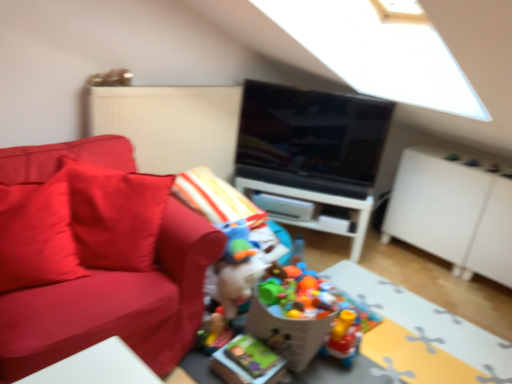
Measure the distance between black glossy tv at center and camera.

2.67 meters.

What is the approximate height of matte red pillow at left?

matte red pillow at left is 21.01 inches in height.

The width and height of the screenshot is (512, 384). What do you see at coordinates (322, 216) in the screenshot?
I see `white plastic table at center, the second table in the front-to-back sequence` at bounding box center [322, 216].

Image resolution: width=512 pixels, height=384 pixels. Describe the element at coordinates (312, 316) in the screenshot. I see `plastic colorful toys at center, arranged as the 1th toy when viewed from the back` at that location.

In the scene shown: Measure the distance between plastic colorful toys at center, which is counted as the 3th toy, starting from the front, and camera.

A distance of 5.95 feet exists between plastic colorful toys at center, which is counted as the 3th toy, starting from the front, and camera.

What do you see at coordinates (242, 276) in the screenshot?
I see `multicolored plastic toys at center, which is the first toy in front-to-back order` at bounding box center [242, 276].

This screenshot has width=512, height=384. Describe the element at coordinates (453, 214) in the screenshot. I see `white matte dresser at right` at that location.

The image size is (512, 384). What are the coordinates of `cardboard box at center, which is the first table from bottom to top` in the screenshot? It's located at (423, 334).

Do you think plastic colorful toys at center, arranged as the 1th toy when viewed from the back, is within matte red pillow at left, or outside of it?

plastic colorful toys at center, arranged as the 1th toy when viewed from the back, is not inside matte red pillow at left, it's outside.

Considering the positions of objects plastic colorful toys at center, arranged as the 1th toy when viewed from the back, and matte red pillow at left in the image provided, who is more to the right, plastic colorful toys at center, arranged as the 1th toy when viewed from the back, or matte red pillow at left?

Positioned to the right is plastic colorful toys at center, arranged as the 1th toy when viewed from the back.

Considering the positions of point (269, 277) and point (25, 184), is point (269, 277) closer or farther from the camera than point (25, 184)?

Point (269, 277) is farther from the camera than point (25, 184).

From a real-world perspective, is plastic colorful toys at center, arranged as the 1th toy when viewed from the back, positioned above or below matte red pillow at left?

In terms of real-world spatial position, plastic colorful toys at center, arranged as the 1th toy when viewed from the back, is below matte red pillow at left.

Is point (266, 156) behind point (339, 355)?

Yes, it is.

From a real-world perspective, which object rests below the other?

translucent plastic toy at center, marked as the second toy in a back-to-front arrangement.

Considering their positions, is black glossy tv at center located in front of or behind translucent plastic toy at center, marked as the second toy in a back-to-front arrangement?

In the image, black glossy tv at center appears behind translucent plastic toy at center, marked as the second toy in a back-to-front arrangement.

Does black glossy tv at center have a greater width compared to translucent plastic toy at center, arranged as the second toy when viewed from the front?

No.

Consider the image. Are matte red pillow at left and cardboard box at center, arranged as the 2th table when viewed from the top, located far from each other?

matte red pillow at left is far away from cardboard box at center, arranged as the 2th table when viewed from the top.

Could you tell me if matte red pillow at left is turned towards cardboard box at center, arranged as the 2th table when viewed from the top?

No, matte red pillow at left is not aimed at cardboard box at center, arranged as the 2th table when viewed from the top.

Looking at the image, does matte red pillow at left seem bigger or smaller compared to cardboard box at center, which is the first table from bottom to top?

matte red pillow at left is bigger than cardboard box at center, which is the first table from bottom to top.

Between matte red pillow at left and cardboard box at center, marked as the first table in a front-to-back arrangement, which one is positioned in front?

Answer: cardboard box at center, marked as the first table in a front-to-back arrangement, is more forward.

Which is more to the right, plastic colorful toys at center, arranged as the 1th toy when viewed from the back, or white plastic table at center, positioned as the 1th table in back-to-front order?

From the viewer's perspective, plastic colorful toys at center, arranged as the 1th toy when viewed from the back, appears more on the right side.

Is white plastic table at center, which is counted as the 2th table, starting from the bottom, at the back of plastic colorful toys at center, which is counted as the 3th toy, starting from the front?

Yes, white plastic table at center, which is counted as the 2th table, starting from the bottom, is at the back of plastic colorful toys at center, which is counted as the 3th toy, starting from the front.

Does plastic colorful toys at center, arranged as the 1th toy when viewed from the back, have a smaller size compared to white plastic table at center, the second table in the front-to-back sequence?

Yes, plastic colorful toys at center, arranged as the 1th toy when viewed from the back, is smaller than white plastic table at center, the second table in the front-to-back sequence.

Is matte red pillow at left facing away from white plastic table at center, positioned as the 1th table in back-to-front order?

No, matte red pillow at left is not facing the opposite direction of white plastic table at center, positioned as the 1th table in back-to-front order.

Is point (52, 233) less distant than point (361, 205)?

Yes, it is in front of point (361, 205).

Considering the sizes of objects matte red pillow at left and white plastic table at center, which is counted as the 2th table, starting from the bottom, in the image provided, who is smaller, matte red pillow at left or white plastic table at center, which is counted as the 2th table, starting from the bottom,?

→ matte red pillow at left is smaller.

From the image's perspective, is matte red pillow at left on top of white plastic table at center, the 1th table when ordered from top to bottom?

Yes.

Considering the sizes of objects white plastic table at center, positioned as the 1th table in back-to-front order, and multicolored plastic toys at center, which is the first toy in front-to-back order, in the image provided, who is thinner, white plastic table at center, positioned as the 1th table in back-to-front order, or multicolored plastic toys at center, which is the first toy in front-to-back order,?

white plastic table at center, positioned as the 1th table in back-to-front order, is thinner.

Is point (351, 206) positioned before point (265, 340)?

That is False.

Is white plastic table at center, which is counted as the 2th table, starting from the bottom, at the left side of multicolored plastic toys at center, which is the third toy from back to front?

Incorrect, white plastic table at center, which is counted as the 2th table, starting from the bottom, is not on the left side of multicolored plastic toys at center, which is the third toy from back to front.

Is white plastic table at center, positioned as the 1th table in back-to-front order, in contact with multicolored plastic toys at center, which is the first toy in front-to-back order?

No, white plastic table at center, positioned as the 1th table in back-to-front order, is not in contact with multicolored plastic toys at center, which is the first toy in front-to-back order.

Can white matte dresser at right be found inside multicolored plastic toys at center, which is the first toy in front-to-back order?

No, white matte dresser at right is not a part of multicolored plastic toys at center, which is the first toy in front-to-back order.

Does point (244, 286) come behind point (434, 217)?

No, it is in front of (434, 217).

Considering the relative positions of multicolored plastic toys at center, which is the third toy from back to front, and white matte dresser at right in the image provided, is multicolored plastic toys at center, which is the third toy from back to front, to the left of white matte dresser at right from the viewer's perspective?

Indeed, multicolored plastic toys at center, which is the third toy from back to front, is positioned on the left side of white matte dresser at right.

Is multicolored plastic toys at center, which is the third toy from back to front, facing towards white matte dresser at right?

No, multicolored plastic toys at center, which is the third toy from back to front, is not facing towards white matte dresser at right.

This screenshot has width=512, height=384. Identify the location of the 3rd toy directly beneath the matte red pillow at left (from a real-world perspective). (312, 316).

The width and height of the screenshot is (512, 384). I want to click on television above the translucent plastic toy at center, marked as the second toy in a back-to-front arrangement (from the image's perspective), so click(x=311, y=139).

Looking at the image, which one is located closer to white plastic table at center, positioned as the 1th table in back-to-front order, multicolored plastic toys at center, which is the third toy from back to front, or white matte dresser at right?

white matte dresser at right.

When comparing their distances from multicolored plastic toys at center, which is the first toy in front-to-back order, does matte red couch at left or translucent plastic toy at center, arranged as the second toy when viewed from the front, seem closer?

translucent plastic toy at center, arranged as the second toy when viewed from the front, is closer to multicolored plastic toys at center, which is the first toy in front-to-back order.

When comparing their distances from cardboard box at center, marked as the first table in a front-to-back arrangement, does black glossy tv at center or plastic colorful toys at center, which is counted as the 3th toy, starting from the front, seem closer?

Among the two, plastic colorful toys at center, which is counted as the 3th toy, starting from the front, is located nearer to cardboard box at center, marked as the first table in a front-to-back arrangement.

When comparing their distances from white plastic table at center, the second table in the front-to-back sequence, does black glossy tv at center or multicolored plastic toys at center, which is the first toy in front-to-back order, seem further?

multicolored plastic toys at center, which is the first toy in front-to-back order, is further to white plastic table at center, the second table in the front-to-back sequence.

Estimate the real-world distances between objects in this image. Which object is closer to cardboard box at center, which is the first table from bottom to top, white matte dresser at right or plastic colorful toys at center, arranged as the 1th toy when viewed from the back?

Based on the image, plastic colorful toys at center, arranged as the 1th toy when viewed from the back, appears to be nearer to cardboard box at center, which is the first table from bottom to top.

Based on their spatial positions, is matte red pillow at left or plastic colorful toys at center, arranged as the 1th toy when viewed from the back, closer to cardboard box at center, arranged as the 2th table when viewed from the top?

plastic colorful toys at center, arranged as the 1th toy when viewed from the back, is closer to cardboard box at center, arranged as the 2th table when viewed from the top.

When comparing their distances from translucent plastic toy at center, arranged as the second toy when viewed from the front, does matte red pillow at left or white plastic table at center, which is counted as the 2th table, starting from the bottom, seem closer?

white plastic table at center, which is counted as the 2th table, starting from the bottom, is positioned closer to the anchor translucent plastic toy at center, arranged as the second toy when viewed from the front.

Based on their spatial positions, is multicolored plastic toys at center, which is the first toy in front-to-back order, or cardboard box at center, which is the first table from bottom to top, closer to translucent plastic toy at center, marked as the second toy in a back-to-front arrangement?

Based on the image, cardboard box at center, which is the first table from bottom to top, appears to be nearer to translucent plastic toy at center, marked as the second toy in a back-to-front arrangement.

You are a GUI agent. You are given a task and a screenshot of the screen. Output one action in this format:
    pyautogui.click(x=<x>, y=<y>)
    Task: Click on the television between multicolored plastic toys at center, which is the third toy from back to front, and white plastic table at center, the 1th table when ordered from top to bottom, in the front-back direction
    The height and width of the screenshot is (384, 512).
    Given the screenshot: What is the action you would take?
    pyautogui.click(x=311, y=139)

Identify the location of dresser between cardboard box at center, which is the first table from bottom to top, and white plastic table at center, which is counted as the 2th table, starting from the bottom, along the z-axis. coord(453,214).

Identify the location of table between matte red couch at left and black glossy tv at center in the front-back direction. The width and height of the screenshot is (512, 384). (423, 334).

I want to click on toy located between cardboard box at center, the 2th table from the back, and translucent plastic toy at center, marked as the second toy in a back-to-front arrangement, in the depth direction, so click(242, 276).